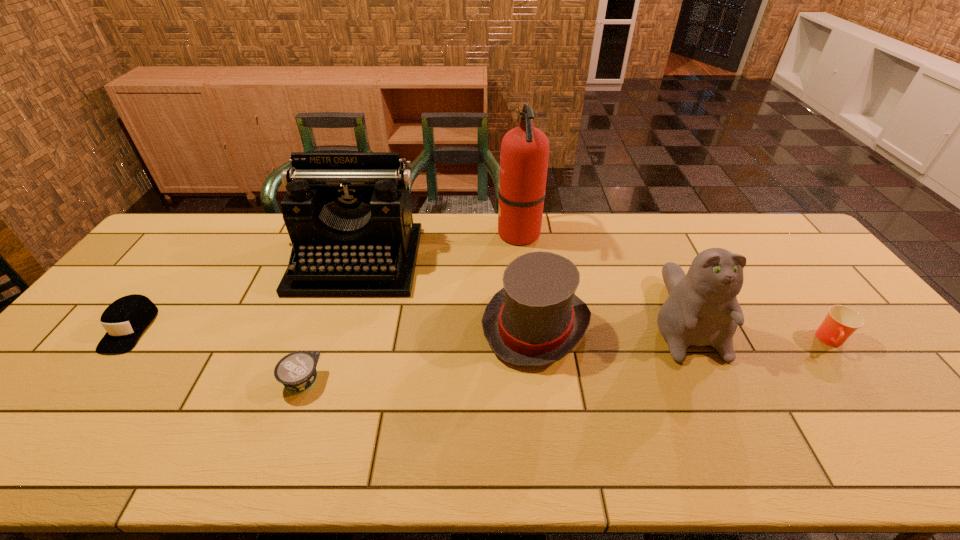
Where is `vacant region located on the typing side of the typewriter`? The image size is (960, 540). vacant region located on the typing side of the typewriter is located at coordinates (321, 370).

You are a GUI agent. You are given a task and a screenshot of the screen. Output one action in this format:
    pyautogui.click(x=<x>, y=<y>)
    Task: Click on the vacant space located 0.100m on the face of the second object from right to left
    
    Given the screenshot: What is the action you would take?
    pyautogui.click(x=720, y=399)

This screenshot has width=960, height=540. In order to click on blank space located 0.190m on the back of the fourth shortest object in this screenshot , I will do `click(526, 248)`.

Where is `vacant space located on the back of the cup`? This screenshot has height=540, width=960. vacant space located on the back of the cup is located at coordinates (796, 294).

You are a GUI agent. You are given a task and a screenshot of the screen. Output one action in this format:
    pyautogui.click(x=<x>, y=<y>)
    Task: Click on the free space located 0.180m on the front-facing side of the leftmost object
    This screenshot has width=960, height=540.
    Given the screenshot: What is the action you would take?
    pyautogui.click(x=60, y=418)

This screenshot has height=540, width=960. Identify the location of blank space located 0.330m on the left of the yogurt. (147, 381).

Find the location of a particular element. fire extinguisher at the far edge is located at coordinates (524, 155).

Locate an element on the screen. The width and height of the screenshot is (960, 540). typewriter that is at the far edge is located at coordinates (348, 214).

You are a GUI agent. You are given a task and a screenshot of the screen. Output one action in this format:
    pyautogui.click(x=<x>, y=<y>)
    Task: Click on the object that is at the left edge
    Image resolution: width=960 pixels, height=540 pixels.
    Given the screenshot: What is the action you would take?
    pyautogui.click(x=125, y=319)

The height and width of the screenshot is (540, 960). In order to click on object positioned at the right edge in this screenshot , I will do `click(841, 322)`.